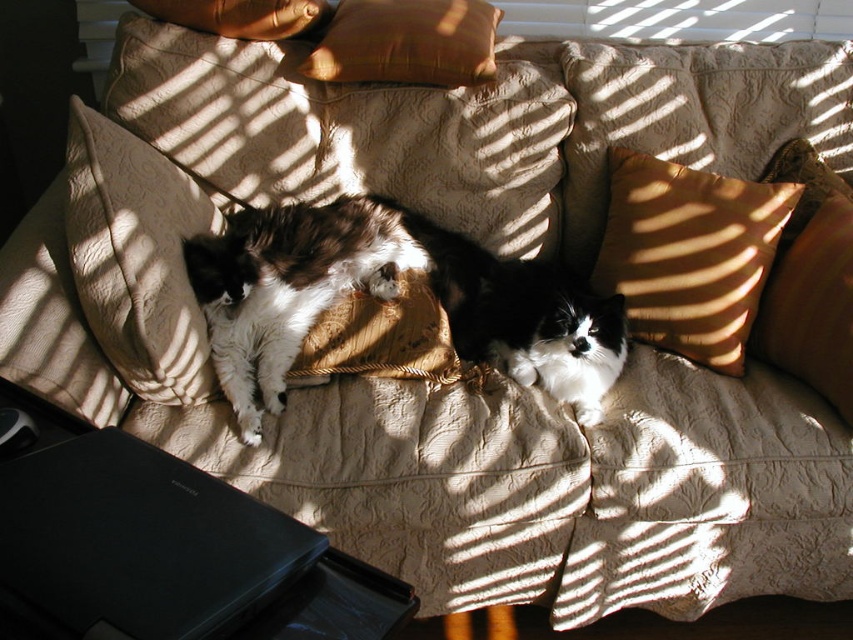
From the picture: Does matte orange pillow at right come behind velvet orange pillow at upper center?

No, matte orange pillow at right is closer to the viewer.

Who is more forward, (842, 355) or (318, 13)?

Point (842, 355)

Find the location of a particular element. This screenshot has height=640, width=853. matte orange pillow at right is located at coordinates (809, 280).

Who is lower down, white fluffy cat at center or velvet orange pillow at upper center?

Positioned lower is white fluffy cat at center.

Is white fluffy cat at center smaller than velvet orange pillow at upper center?

Actually, white fluffy cat at center might be larger than velvet orange pillow at upper center.

Find the location of a particular element. white fluffy cat at center is located at coordinates click(x=526, y=317).

I want to click on white fluffy cat at center, so click(x=526, y=317).

Is white fluffy cat at center positioned behind matte orange pillow at right?

Yes.

Between point (576, 333) and point (833, 388), which one is positioned behind?

The point (576, 333) is behind.

Measure the distance between point (577, 316) and camera.

The distance of point (577, 316) from camera is 5.39 feet.

The height and width of the screenshot is (640, 853). In order to click on white fluffy cat at center in this screenshot , I will do `click(526, 317)`.